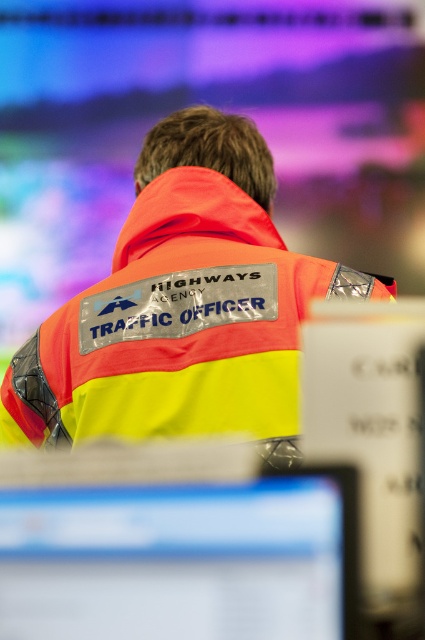
Can you confirm if orange reflective jacket at center is smaller than matte plastic monitor at lower center?

No.

Does orange reflective jacket at center have a lesser width compared to matte plastic monitor at lower center?

In fact, orange reflective jacket at center might be wider than matte plastic monitor at lower center.

Find the location of `orange reflective jacket at center`. orange reflective jacket at center is located at coordinates (181, 307).